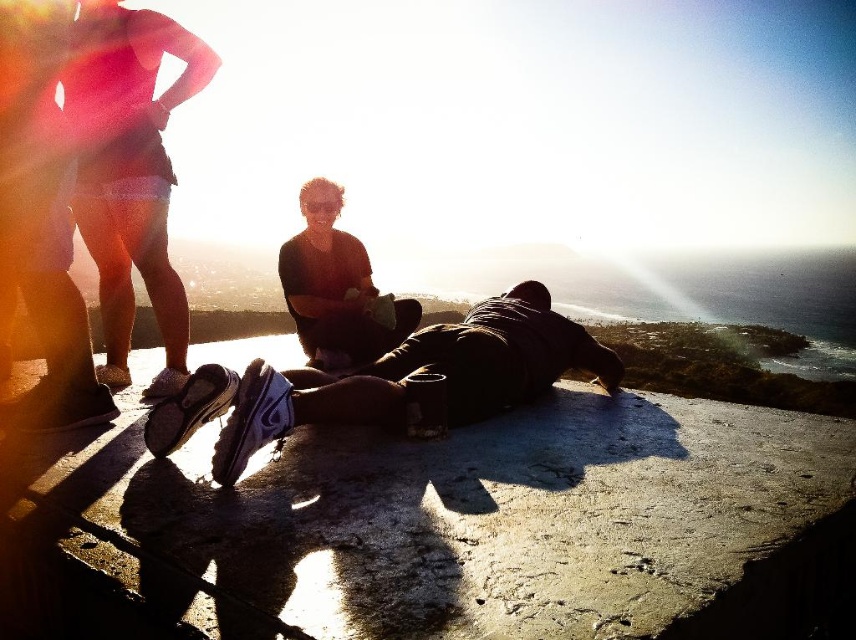
Question: Is dark brown leather jacket at center above matte black shirt at center?

Choices:
 (A) yes
 (B) no

Answer: (B)

Question: Among these objects, which one is farthest from the camera?

Choices:
 (A) matte black shirt at center
 (B) dark brown leather jacket at center

Answer: (A)

Question: Which of the following is the farthest from the observer?

Choices:
 (A) (403, 340)
 (B) (311, 324)

Answer: (B)

Question: Can you confirm if dark brown leather jacket at center is positioned to the left of matte black shirt at center?

Choices:
 (A) yes
 (B) no

Answer: (B)

Question: Can you confirm if dark brown leather jacket at center is positioned to the left of matte black shirt at center?

Choices:
 (A) no
 (B) yes

Answer: (A)